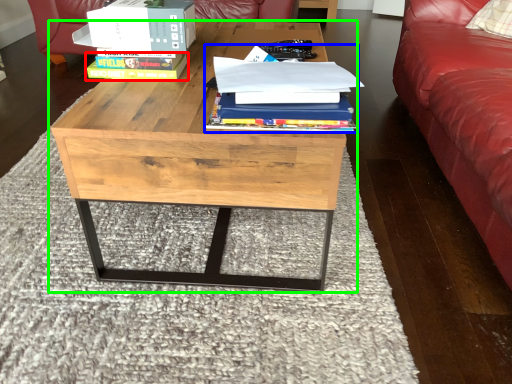
Question: Which is nearer to the paperback book (highlighted by a red box)? book (highlighted by a blue box) or coffee table (highlighted by a green box).

Choices:
 (A) book
 (B) coffee table

Answer: (B)